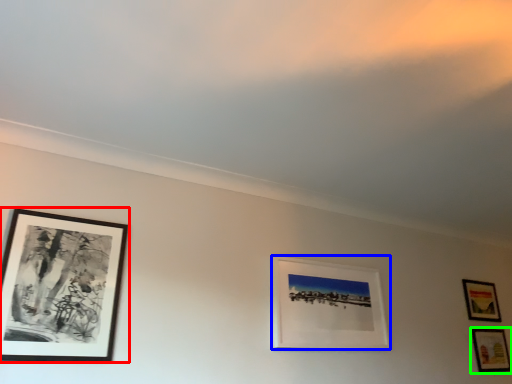
Question: Considering the real-world distances, which object is farthest from picture frame (highlighted by a red box)? picture frame (highlighted by a blue box) or picture frame (highlighted by a green box)?

Choices:
 (A) picture frame
 (B) picture frame

Answer: (B)